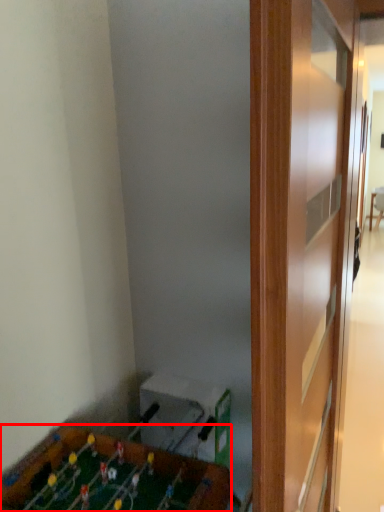
Question: From the image's perspective, where is furniture (annotated by the red box) located relative to table?

Choices:
 (A) above
 (B) below

Answer: (B)